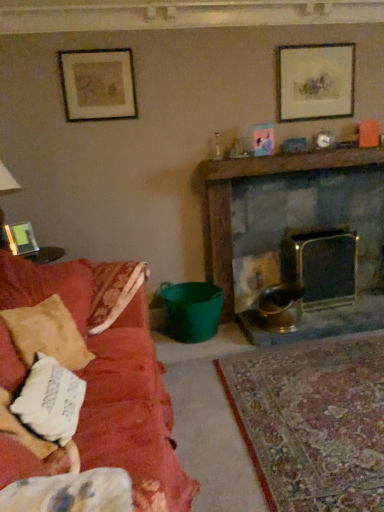
Question: Considering the relative sizes of wooden mantel at upper center and dark gray stone fireplace at center right in the image provided, is wooden mantel at upper center thinner than dark gray stone fireplace at center right?

Choices:
 (A) yes
 (B) no

Answer: (B)

Question: Are wooden mantel at upper center and dark gray stone fireplace at center right far apart?

Choices:
 (A) no
 (B) yes

Answer: (A)

Question: From a real-world perspective, is wooden mantel at upper center physically below dark gray stone fireplace at center right?

Choices:
 (A) yes
 (B) no

Answer: (B)

Question: Is wooden mantel at upper center facing away from dark gray stone fireplace at center right?

Choices:
 (A) no
 (B) yes

Answer: (A)

Question: Is wooden mantel at upper center closer to the viewer compared to dark gray stone fireplace at center right?

Choices:
 (A) no
 (B) yes

Answer: (B)

Question: Considering their positions, is wooden mantel at upper center located in front of or behind dark gray stone fireplace at center right?

Choices:
 (A) front
 (B) behind

Answer: (A)

Question: Is point (377, 153) closer or farther from the camera than point (331, 197)?

Choices:
 (A) farther
 (B) closer

Answer: (B)

Question: From their relative heights in the image, would you say wooden mantel at upper center is taller or shorter than dark gray stone fireplace at center right?

Choices:
 (A) tall
 (B) short

Answer: (B)

Question: Considering the positions of wooden mantel at upper center and dark gray stone fireplace at center right in the image, is wooden mantel at upper center bigger or smaller than dark gray stone fireplace at center right?

Choices:
 (A) small
 (B) big

Answer: (A)

Question: Is matte gold picture frame at upper left, which is the 2th picture frame from bottom to top, taller or shorter than white cotton pillow at left?

Choices:
 (A) tall
 (B) short

Answer: (A)

Question: Is matte gold picture frame at upper left, which is the 2th picture frame from bottom to top, spatially inside white cotton pillow at left, or outside of it?

Choices:
 (A) outside
 (B) inside

Answer: (A)

Question: Is matte gold picture frame at upper left, acting as the 2th picture frame starting from the left, to the left or to the right of white cotton pillow at left in the image?

Choices:
 (A) right
 (B) left

Answer: (B)

Question: Is matte gold picture frame at upper left, arranged as the 2th picture frame when viewed from the right, wider or thinner than white cotton pillow at left?

Choices:
 (A) wide
 (B) thin

Answer: (B)

Question: Relative to matte gold picture frame at upper left, acting as the 2th picture frame starting from the left, is matte glass picture frame at left, the first picture frame when ordered from left to right, in front or behind?

Choices:
 (A) front
 (B) behind

Answer: (B)

Question: Is point (23, 229) positioned closer to the camera than point (122, 49)?

Choices:
 (A) closer
 (B) farther

Answer: (B)